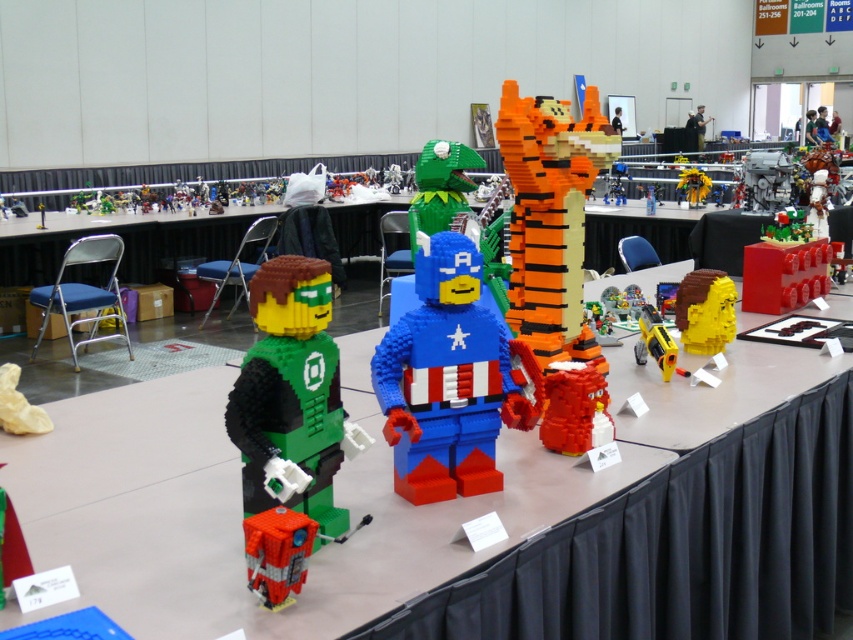
Which of these two, orange striped lego tiger at center or brown matte head at center, stands shorter?

brown matte head at center

Is point (579, 300) closer to camera compared to point (723, 314)?

Yes, point (579, 300) is in front of point (723, 314).

The width and height of the screenshot is (853, 640). Find the location of `orange striped lego tiger at center`. orange striped lego tiger at center is located at coordinates (550, 218).

Is orange striped lego tiger at center below green matte lego dragon at center?

Correct, orange striped lego tiger at center is located below green matte lego dragon at center.

Between orange striped lego tiger at center and green matte lego dragon at center, which one is positioned lower?

orange striped lego tiger at center

Find the location of `orange striped lego tiger at center`. orange striped lego tiger at center is located at coordinates (550, 218).

Does orange striped lego tiger at center have a lesser height compared to matte gray engine at center?

No, orange striped lego tiger at center is not shorter than matte gray engine at center.

Is orange striped lego tiger at center in front of matte gray engine at center?

Yes.

I want to click on orange striped lego tiger at center, so click(550, 218).